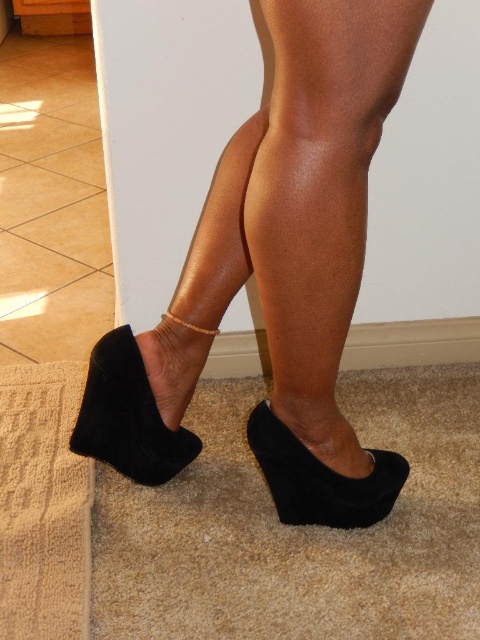
Which is above, suede black wedge at center or suede wedge at center?

Positioned higher is suede black wedge at center.

Is suede black wedge at center to the left of suede wedge at center from the viewer's perspective?

Incorrect, suede black wedge at center is not on the left side of suede wedge at center.

Does point (256, 216) lie behind point (277, 483)?

No.

In order to click on suede black wedge at center in this screenshot , I will do `click(321, 244)`.

Can you confirm if matte black wedge at lower left is bigger than suede wedge shoe at lower left?

Indeed, matte black wedge at lower left has a larger size compared to suede wedge shoe at lower left.

Image resolution: width=480 pixels, height=640 pixels. Identify the location of matte black wedge at lower left. (170, 339).

I want to click on matte black wedge at lower left, so click(x=170, y=339).

This screenshot has width=480, height=640. What do you see at coordinates (170, 339) in the screenshot?
I see `matte black wedge at lower left` at bounding box center [170, 339].

The height and width of the screenshot is (640, 480). I want to click on matte black wedge at lower left, so click(x=170, y=339).